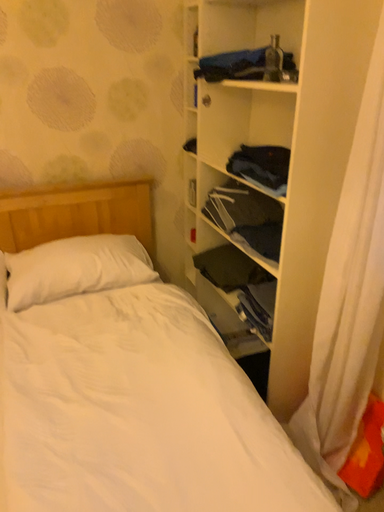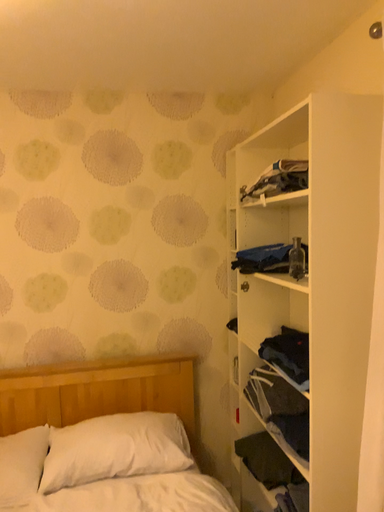
Question: Which way did the camera rotate in the video?

Choices:
 (A) rotated left
 (B) rotated right

Answer: (A)